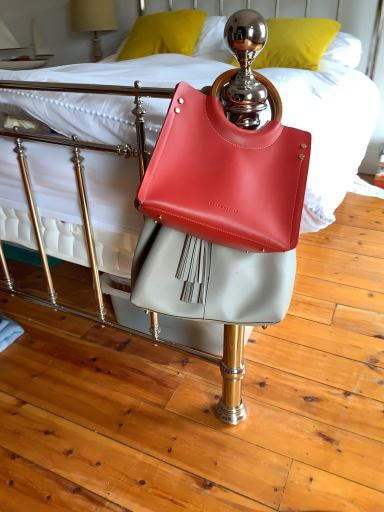
Question: Could you tell me if matte beige lampshade at upper left is turned towards metallic gold pillow at upper center, acting as the 1th pillow starting from the right?

Choices:
 (A) yes
 (B) no

Answer: (B)

Question: Is matte beige lampshade at upper left shorter than metallic gold pillow at upper center, acting as the second pillow starting from the left?

Choices:
 (A) yes
 (B) no

Answer: (B)

Question: Considering the relative sizes of matte beige lampshade at upper left and metallic gold pillow at upper center, acting as the second pillow starting from the left, in the image provided, is matte beige lampshade at upper left thinner than metallic gold pillow at upper center, acting as the second pillow starting from the left,?

Choices:
 (A) no
 (B) yes

Answer: (B)

Question: Is matte beige lampshade at upper left smaller than metallic gold pillow at upper center, acting as the second pillow starting from the left?

Choices:
 (A) no
 (B) yes

Answer: (B)

Question: Is matte beige lampshade at upper left outside of metallic gold pillow at upper center, acting as the 1th pillow starting from the right?

Choices:
 (A) no
 (B) yes

Answer: (B)

Question: Does matte beige lampshade at upper left come behind metallic gold pillow at upper center, acting as the 1th pillow starting from the right?

Choices:
 (A) no
 (B) yes

Answer: (B)

Question: Is matte beige lampshade at upper left at the right side of matte leather handbag at center?

Choices:
 (A) yes
 (B) no

Answer: (B)

Question: Is matte beige lampshade at upper left aimed at matte leather handbag at center?

Choices:
 (A) no
 (B) yes

Answer: (A)

Question: Is matte leather handbag at center at the back of matte beige lampshade at upper left?

Choices:
 (A) no
 (B) yes

Answer: (A)

Question: Does matte beige lampshade at upper left touch matte leather handbag at center?

Choices:
 (A) no
 (B) yes

Answer: (A)

Question: Is matte beige lampshade at upper left wider than matte leather handbag at center?

Choices:
 (A) no
 (B) yes

Answer: (B)

Question: Considering the relative sizes of matte beige lampshade at upper left and matte leather handbag at center in the image provided, is matte beige lampshade at upper left smaller than matte leather handbag at center?

Choices:
 (A) no
 (B) yes

Answer: (A)

Question: Is matte beige lampshade at upper left bigger than matte yellow pillow at upper center, which is the first pillow in left-to-right order?

Choices:
 (A) yes
 (B) no

Answer: (B)